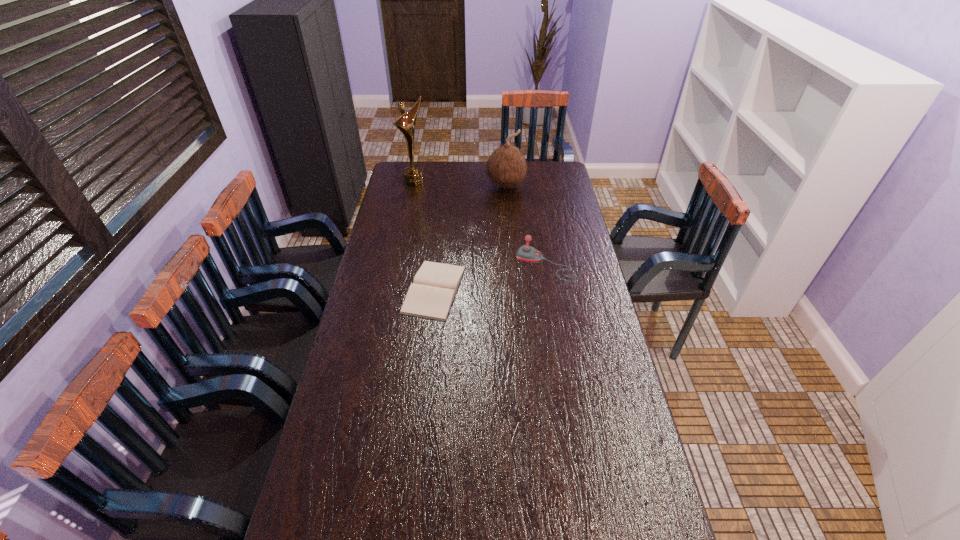
Identify the location of vacant region between the joystick and the award. The height and width of the screenshot is (540, 960). (481, 223).

This screenshot has height=540, width=960. I want to click on empty space that is in between the shortest object and the third tallest object, so click(491, 277).

Locate an element on the screen. This screenshot has height=540, width=960. empty space between the coconut and the award is located at coordinates (460, 184).

Image resolution: width=960 pixels, height=540 pixels. I want to click on unoccupied position between the coconut and the Bible, so click(470, 238).

At what (x,y) coordinates should I click in order to perform the action: click on vacant space in between the award and the third shortest object. Please return your answer as a coordinate pair (x, y). The image size is (960, 540). Looking at the image, I should click on (460, 184).

Locate which object ranks in proximity to the third tallest object. Please provide its 2D coordinates. Your answer should be formatted as a tuple, i.e. [(x, y)], where the tuple contains the x and y coordinates of a point satisfying the conditions above.

[(431, 295)]

Point out which object is positioned as the third nearest to the coconut. Please provide its 2D coordinates. Your answer should be formatted as a tuple, i.e. [(x, y)], where the tuple contains the x and y coordinates of a point satisfying the conditions above.

[(431, 295)]

At what (x,y) coordinates should I click in order to perform the action: click on vacant point that satisfies the following two spatial constraints: 1. on the front side of the tallest object; 2. on the right side of the second shortest object. Please return your answer as a coordinate pair (x, y). Looking at the image, I should click on (397, 265).

Where is `vacant space that satisfies the following two spatial constraints: 1. on the front side of the second shortest object; 2. on the right side of the award`? The width and height of the screenshot is (960, 540). vacant space that satisfies the following two spatial constraints: 1. on the front side of the second shortest object; 2. on the right side of the award is located at coordinates (397, 265).

You are a GUI agent. You are given a task and a screenshot of the screen. Output one action in this format:
    pyautogui.click(x=<x>, y=<y>)
    Task: Click on the vacant point that satisfies the following two spatial constraints: 1. on the front side of the third shortest object; 2. on the right side of the third tallest object
    This screenshot has height=540, width=960.
    Given the screenshot: What is the action you would take?
    pyautogui.click(x=513, y=265)